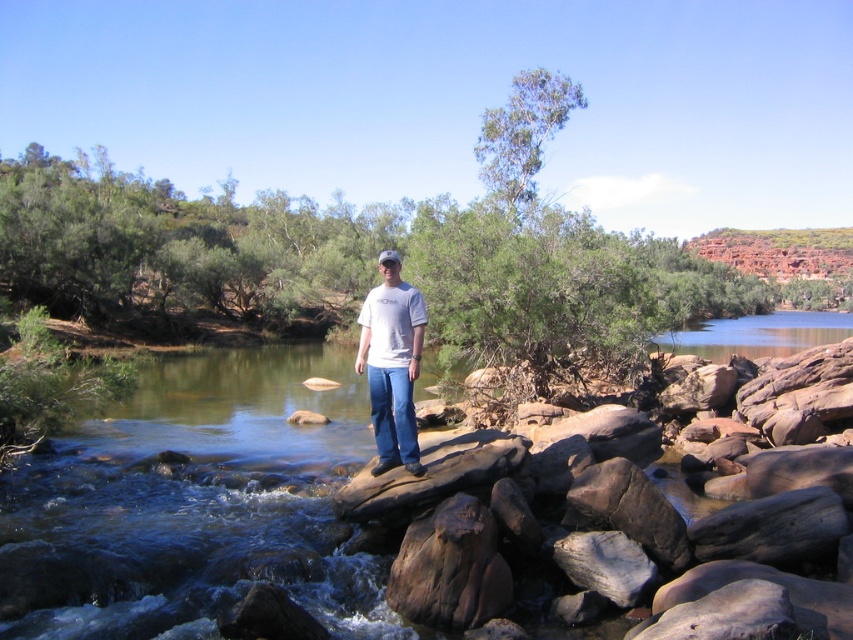
Question: Does clear water at stream center have a greater width compared to white cotton t-shirt at center?

Choices:
 (A) no
 (B) yes

Answer: (B)

Question: Which point is farther to the camera?

Choices:
 (A) clear water at stream center
 (B) white cotton t-shirt at center

Answer: (B)

Question: Which point is closer to the camera?

Choices:
 (A) (341, 572)
 (B) (384, 369)

Answer: (A)

Question: Which point appears farthest from the camera in this image?

Choices:
 (A) (120, 442)
 (B) (381, 451)

Answer: (A)

Question: In this image, where is clear water at stream center located relative to white cotton t-shirt at center?

Choices:
 (A) left
 (B) right

Answer: (B)

Question: Is the position of clear water at stream center less distant than that of white cotton t-shirt at center?

Choices:
 (A) yes
 (B) no

Answer: (A)